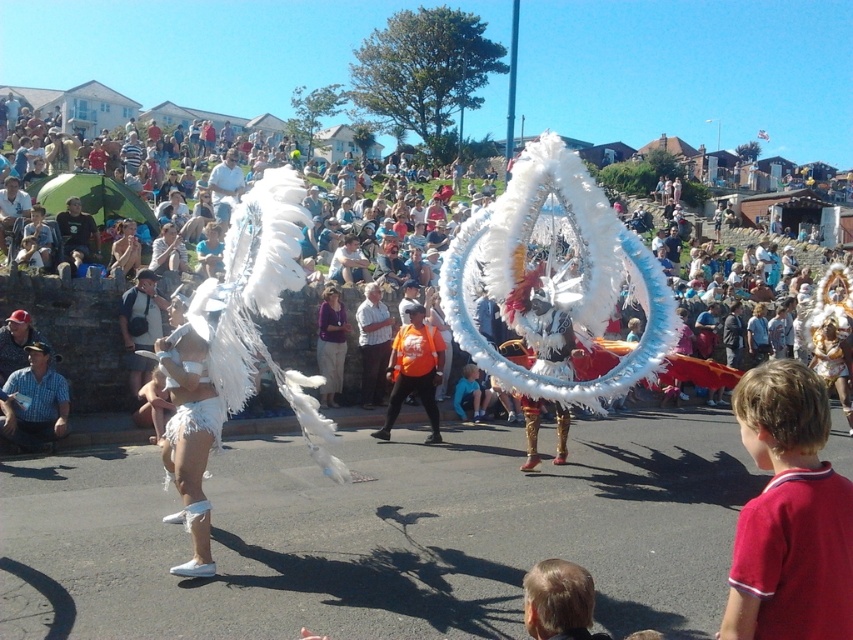
Question: Is white fluffy feathers at center thinner than light blue denim shorts at center?

Choices:
 (A) no
 (B) yes

Answer: (B)

Question: Which point is farther to the camera?

Choices:
 (A) 782,422
 (B) 254,406
 (C) 433,404
 (D) 477,392

Answer: (D)

Question: Estimate the real-world distances between objects in this image. Which object is closer to the red cotton shirt at lower right?

Choices:
 (A) white fluffy feathers at center
 (B) light blue denim shorts at center
 (C) orange fabric shirt at center

Answer: (C)

Question: Which of the following is the closest to the observer?

Choices:
 (A) light blue denim shorts at center
 (B) white fluffy feathers at center
 (C) red cotton shirt at lower right
 (D) orange fabric shirt at center

Answer: (C)

Question: Is white fluffy feathers at center smaller than orange fabric shirt at center?

Choices:
 (A) yes
 (B) no

Answer: (A)

Question: Does white fluffy feathers at center appear over light blue denim shorts at center?

Choices:
 (A) no
 (B) yes

Answer: (B)